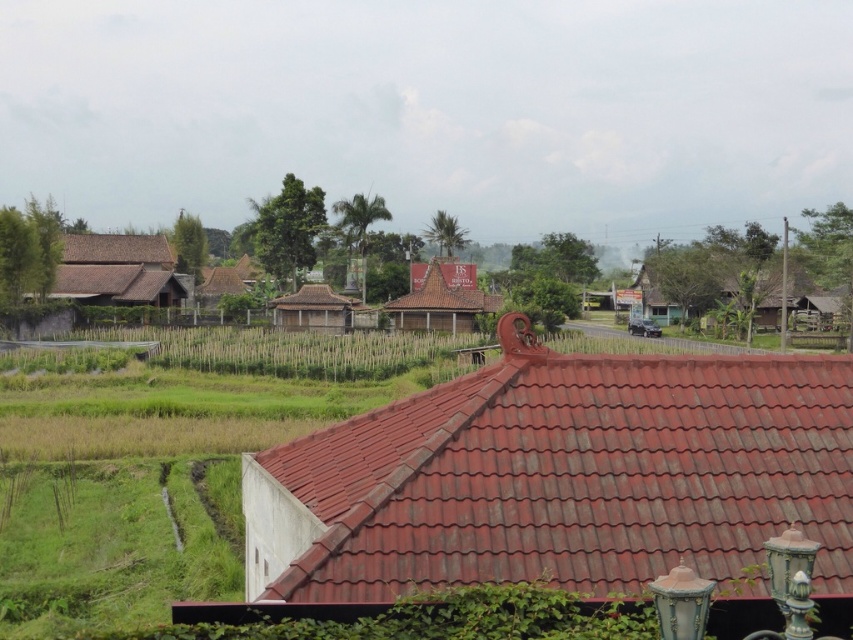
You are a visitor exploring the rural landscape and want to take a photo of both the brown textured hut at center and the brown wooden hut at center. Which one should you focus on first to ensure both are in the frame?

You should focus on the brown textured hut at center first because it is in front of the brown wooden hut at center, so adjusting the camera to include the closer one will naturally include the one behind it as well.